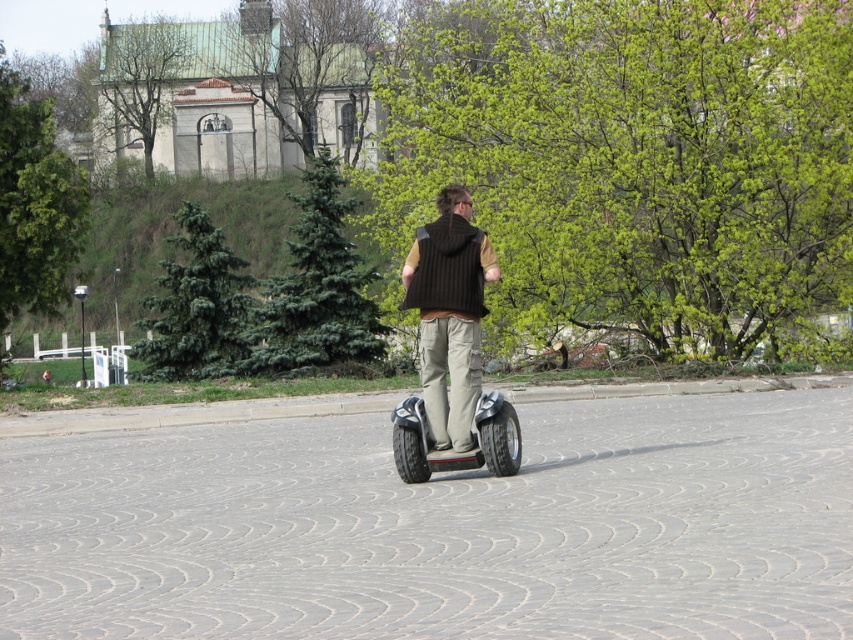
Looking at this image, does knit brown vest at center appear on the right side of black rubber segway at center?

No, knit brown vest at center is not to the right of black rubber segway at center.

Based on the photo, can you confirm if knit brown vest at center is smaller than black rubber segway at center?

No.

Who is more forward, (x=426, y=241) or (x=418, y=467)?

Positioned in front is point (x=426, y=241).

This screenshot has height=640, width=853. In order to click on knit brown vest at center in this screenshot , I will do `click(450, 312)`.